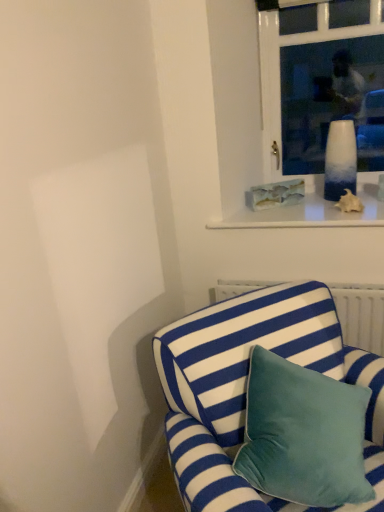
Question: Is white glass vase at upper center taller or shorter than translucent glass vase at upper right?

Choices:
 (A) tall
 (B) short

Answer: (A)

Question: In the image, is white glass vase at upper center positioned in front of or behind translucent glass vase at upper right?

Choices:
 (A) behind
 (B) front

Answer: (B)

Question: Based on their relative distances, which object is nearer to the blue and white striped fabric couch at lower right?

Choices:
 (A) translucent glass vase at upper right
 (B) white glass vase at upper center

Answer: (A)

Question: Which object is the closest to the blue and white striped fabric couch at lower right?

Choices:
 (A) white glass vase at upper center
 (B) translucent glass vase at upper right

Answer: (B)